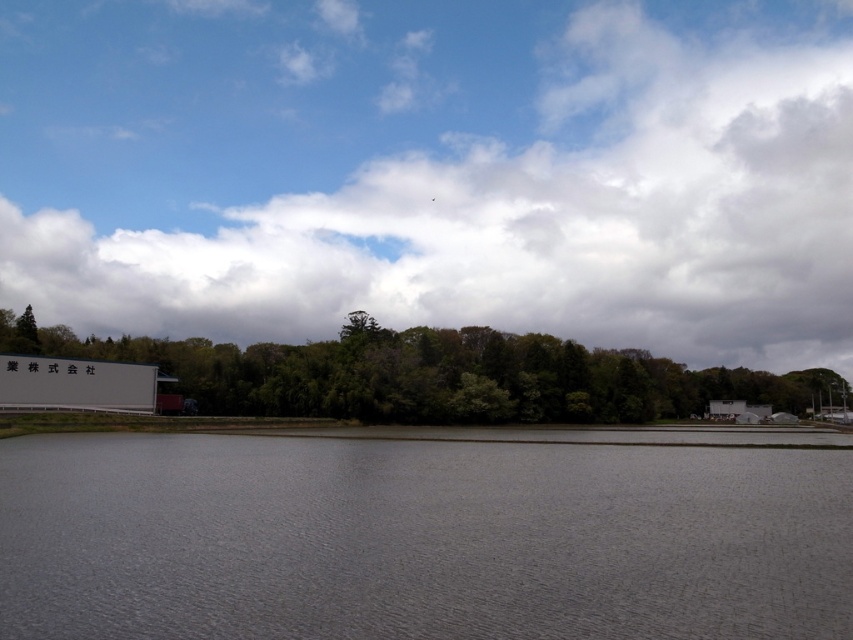
Question: Observing the image, what is the correct spatial positioning of gray matte water at center in reference to green leafy trees at lower center?

Choices:
 (A) right
 (B) left

Answer: (B)

Question: Is white fluffy cloud at upper center further to the viewer compared to green leafy trees at lower center?

Choices:
 (A) no
 (B) yes

Answer: (B)

Question: Which is farther from the green leafy trees at lower center?

Choices:
 (A) white fluffy cloud at upper center
 (B) gray matte water at center

Answer: (A)

Question: Estimate the real-world distances between objects in this image. Which object is closer to the white fluffy cloud at upper center?

Choices:
 (A) gray matte water at center
 (B) green leafy trees at lower center

Answer: (B)

Question: Which of these objects is positioned closest to the green leafy trees at lower center?

Choices:
 (A) gray matte water at center
 (B) white fluffy cloud at upper center

Answer: (A)

Question: Can you confirm if gray matte water at center is bigger than green leafy trees at lower center?

Choices:
 (A) no
 (B) yes

Answer: (A)